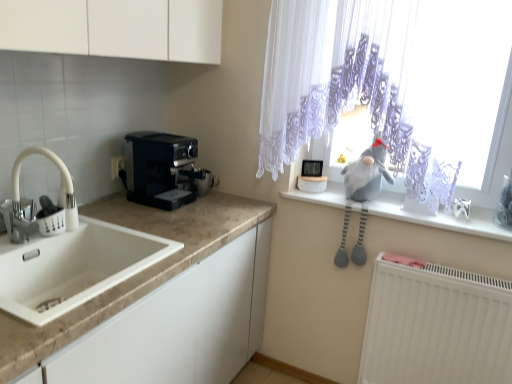
Question: Is point [113, 175] closer or farther from the camera than point [57, 160]?

Choices:
 (A) closer
 (B) farther

Answer: (B)

Question: Relative to white matte faucet at left, is white plastic electric outlet at left in front or behind?

Choices:
 (A) front
 (B) behind

Answer: (B)

Question: Estimate the real-world distances between objects in this image. Which object is closer to the black plastic coffee maker at left?

Choices:
 (A) white matte radiator at lower right
 (B) white marble countertop at lower left
 (C) white lace curtain at upper right
 (D) white matte faucet at left
 (E) white plastic electric outlet at left

Answer: (B)

Question: Which is farther from the gray plush toy at upper right?

Choices:
 (A) white plastic electric outlet at left
 (B) white matte radiator at lower right
 (C) white lace curtain at upper right
 (D) white marble countertop at lower left
 (E) white matte faucet at left

Answer: (E)